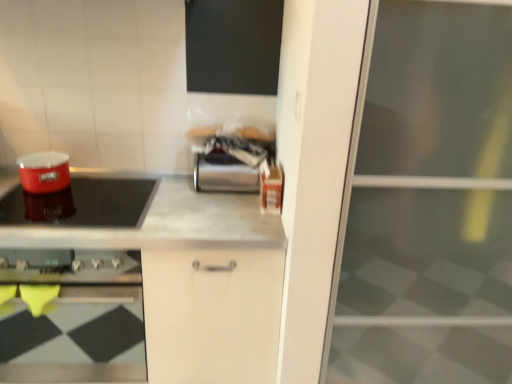
Identify the location of vacant region above satin silver canister at center, which ranks as the 2th appliance in left-to-right order (from a real-world perspective). This screenshot has width=512, height=384. (230, 145).